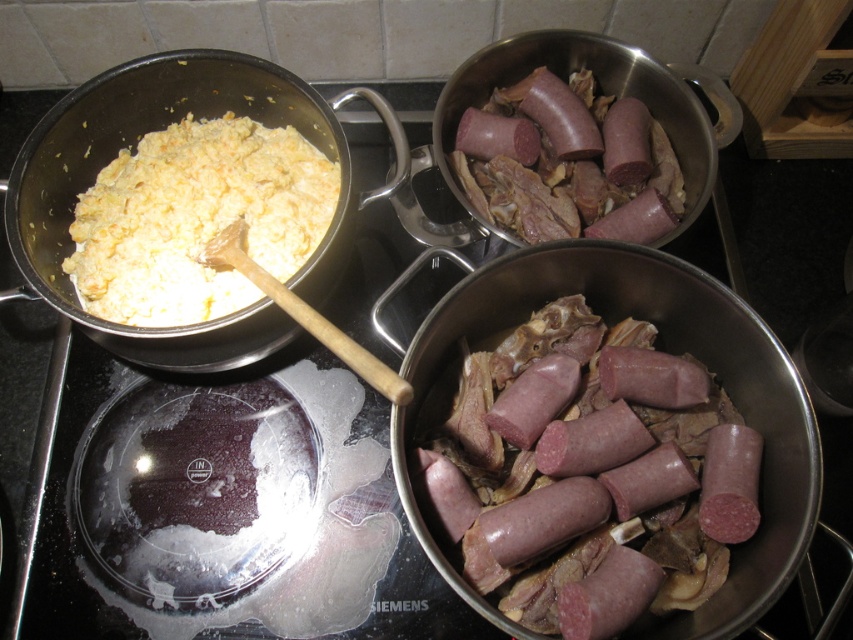
Question: Which point is farther to the camera?

Choices:
 (A) (555, 352)
 (B) (122, 156)
 (C) (663, 163)

Answer: (B)

Question: Can you confirm if white creamy macaroni at upper left is positioned to the right of purple glossy sausage at upper right?

Choices:
 (A) yes
 (B) no

Answer: (B)

Question: Where is purple glossy sausage at center located in relation to white creamy macaroni at upper left in the image?

Choices:
 (A) right
 (B) left

Answer: (A)

Question: Which of these objects is positioned closest to the white creamy macaroni at upper left?

Choices:
 (A) purple glossy sausage at center
 (B) purple glossy sausage at upper right

Answer: (B)

Question: Is the position of purple glossy sausage at center less distant than that of white creamy macaroni at upper left?

Choices:
 (A) no
 (B) yes

Answer: (B)

Question: Considering the real-world distances, which object is farthest from the purple glossy sausage at center?

Choices:
 (A) white creamy macaroni at upper left
 (B) purple glossy sausage at upper right

Answer: (A)